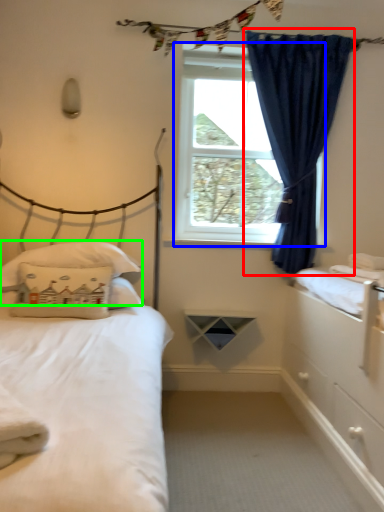
Question: Which object is positioned closest to curtain (highlighted by a red box)? Select from window screen (highlighted by a blue box) and pillow (highlighted by a green box).

Choices:
 (A) window screen
 (B) pillow

Answer: (A)